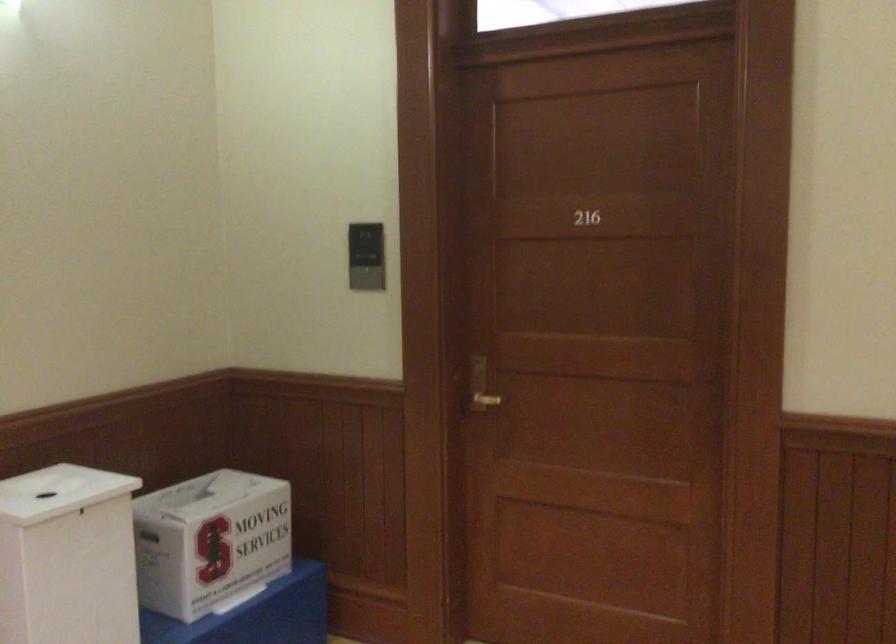
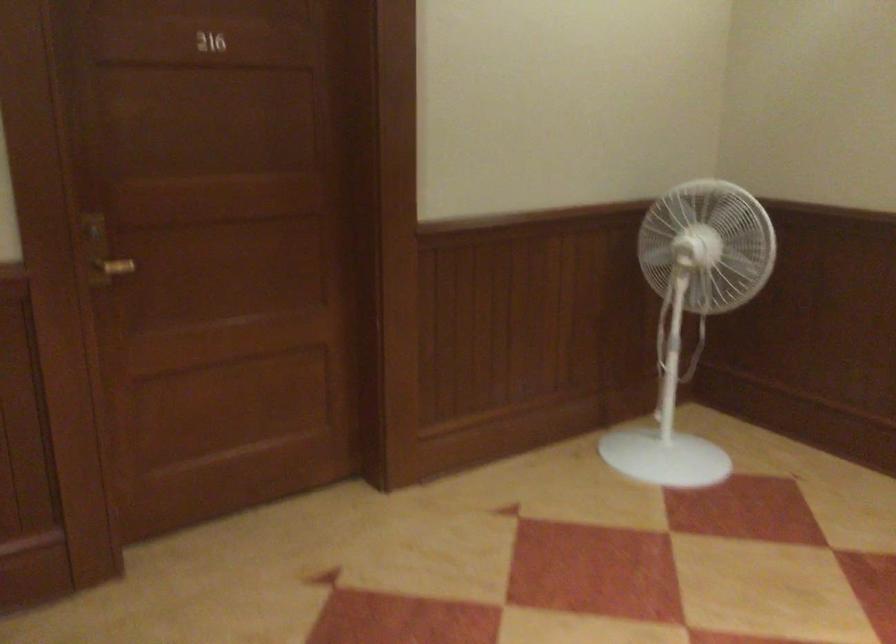
Find the pixel in the second image that matches (474,384) in the first image.

(101, 252)